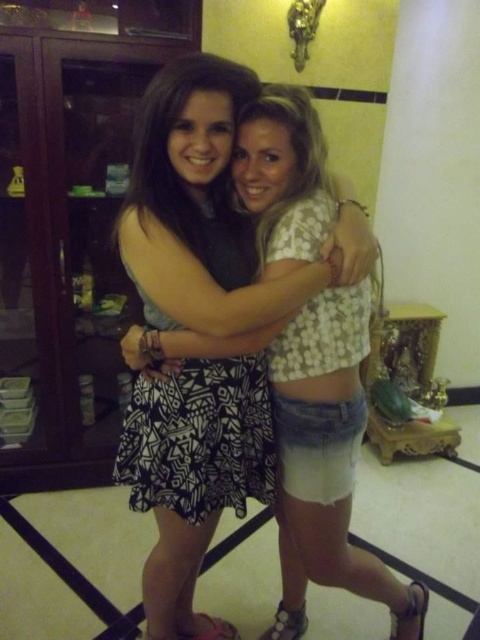
Question: Which object is farther from the camera taking this photo?

Choices:
 (A) white geometric-patterned dress at center
 (B) white printed dress at center

Answer: (A)

Question: In this image, where is white printed dress at center located relative to white geometric-patterned dress at center?

Choices:
 (A) below
 (B) above

Answer: (A)

Question: Considering the relative positions of white printed dress at center and white geometric-patterned dress at center in the image provided, where is white printed dress at center located with respect to white geometric-patterned dress at center?

Choices:
 (A) above
 (B) below

Answer: (B)

Question: Which of the following is the closest to the observer?

Choices:
 (A) white geometric-patterned dress at center
 (B) white printed dress at center

Answer: (B)

Question: Which point appears farthest from the camera in this image?

Choices:
 (A) (229, 240)
 (B) (337, 333)

Answer: (B)

Question: Does white printed dress at center have a lesser width compared to white geometric-patterned dress at center?

Choices:
 (A) no
 (B) yes

Answer: (A)